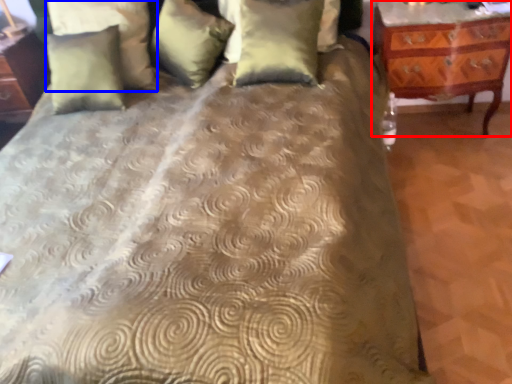
Question: Which object appears closest to the camera in this image, nightstand (highlighted by a red box) or pillow (highlighted by a blue box)?

Choices:
 (A) nightstand
 (B) pillow

Answer: (A)